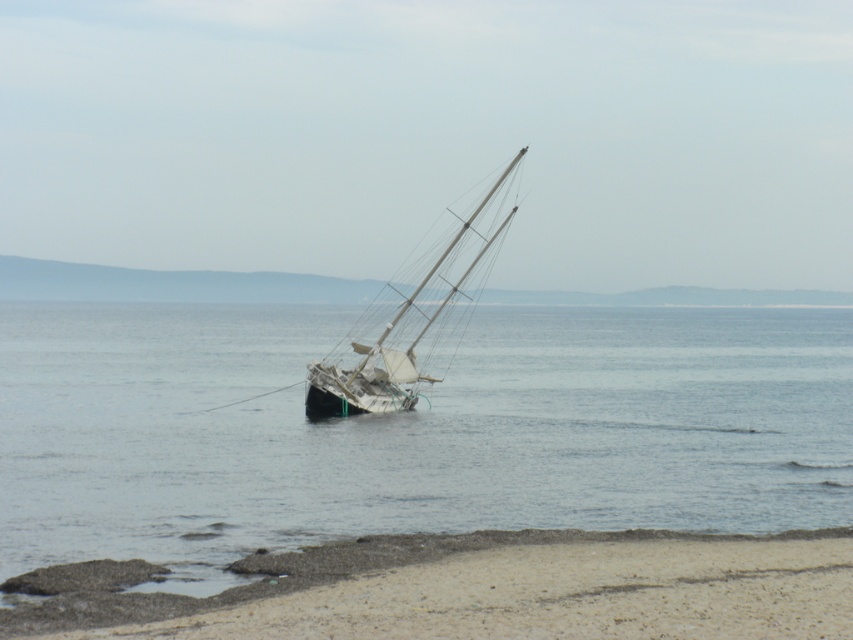
You are a photographer planning to take a photo of the white matte sailboat at center from the sandy beach at lower center. Based on their relative heights, will the sailboat appear taller than the beach in the photo?

The sandy beach at lower center is not as tall as the white matte sailboat at center, so in the photo, the white matte sailboat at center will appear taller than the sandy beach at lower center.

You are a photographer standing at the shore facing the grounded sailboat. You want to take a photo that includes both the point at coordinates point (407, 604) and point (321, 360). Which point should you focus on first to ensure both are in sharp focus?

You should focus on point (407, 604) first because it is closer to the camera than point (321, 360), ensuring both points will be in focus when using a proper depth of field.